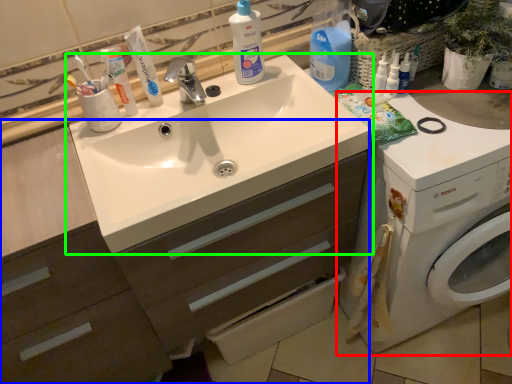
Question: Based on their relative distances, which object is nearer to washing machine (highlighted by a red box)? Choose from dresser (highlighted by a blue box) and sink (highlighted by a green box).

Choices:
 (A) dresser
 (B) sink

Answer: (B)